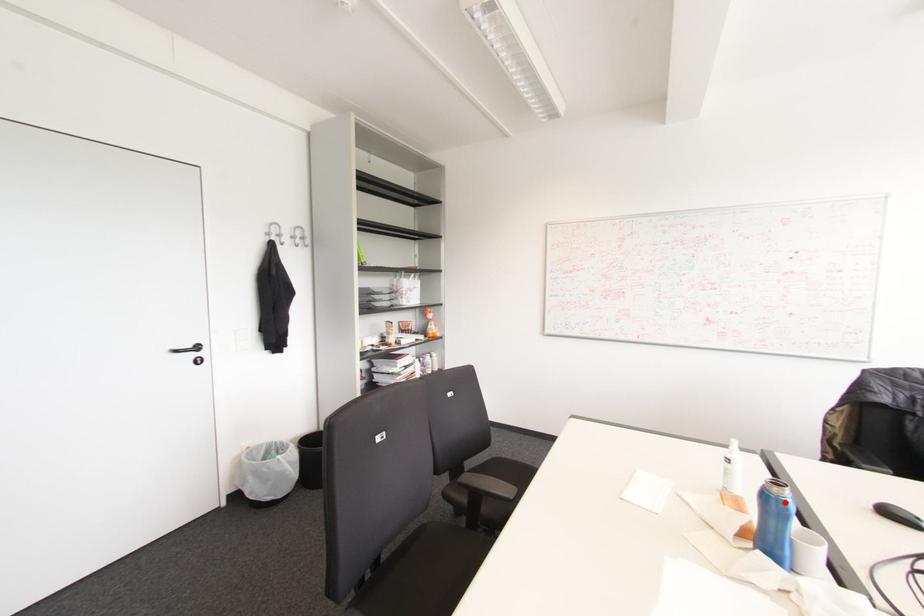
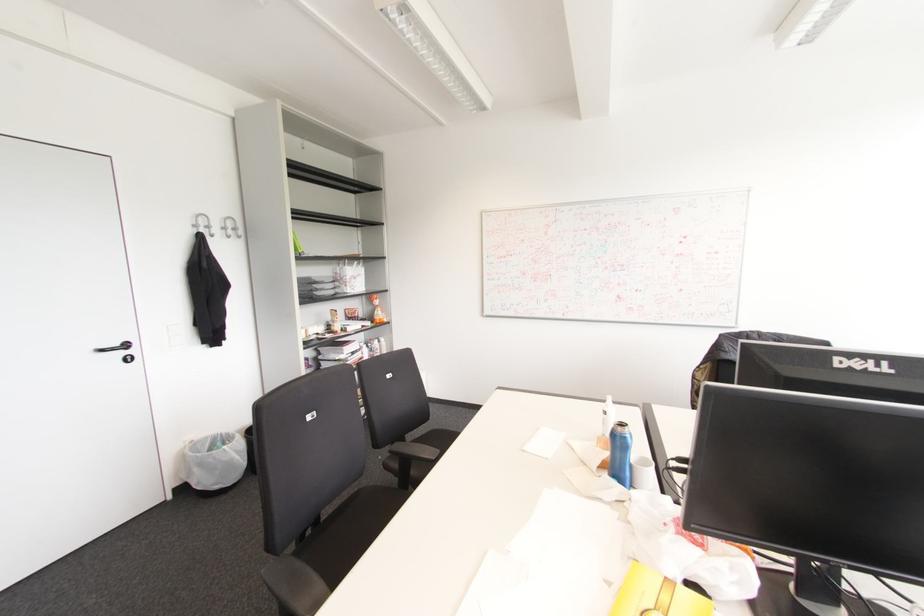
Question: I am providing you with two images of the same scene from different viewpoints. A red point is marked on the first image. At the location where the point appears in image 1, is it still visible in image 2?

Choices:
 (A) Yes
 (B) No

Answer: (A)